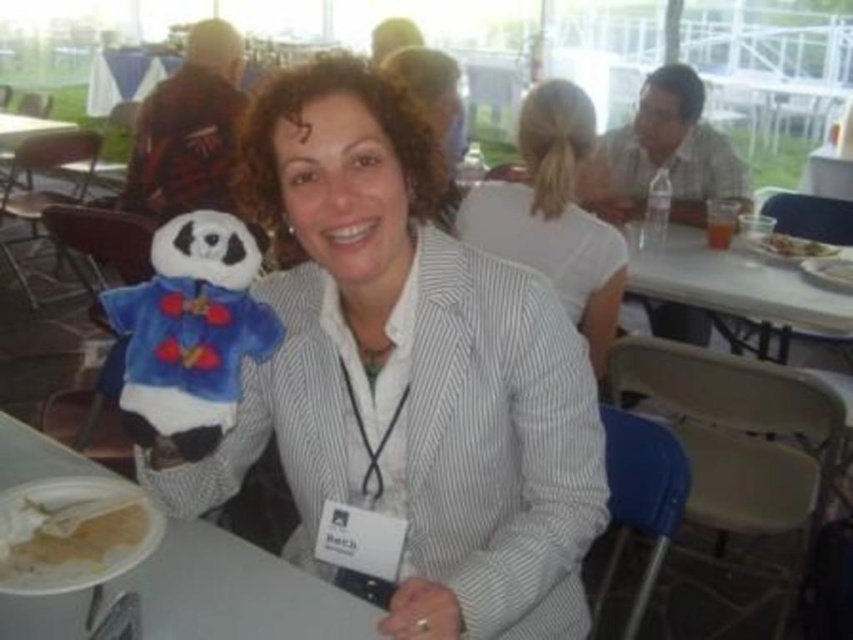
Question: Can you confirm if white plastic plate at lower left is positioned to the right of white matte shirt at upper center?

Choices:
 (A) no
 (B) yes

Answer: (A)

Question: Does white matte shirt at upper center appear on the right side of smooth plastic fork at upper right?

Choices:
 (A) yes
 (B) no

Answer: (B)

Question: Is white matte shirt at upper center below white plastic table at upper right?

Choices:
 (A) no
 (B) yes

Answer: (A)

Question: Which point is farther from the camera taking this photo?

Choices:
 (A) (32, 586)
 (B) (784, 241)

Answer: (B)

Question: Which point appears farthest from the camera in this image?

Choices:
 (A) (538, 604)
 (B) (164, 369)
 (C) (761, 241)

Answer: (C)

Question: Estimate the real-world distances between objects in this image. Which object is farther from the smooth plastic fork at upper right?

Choices:
 (A) white paper plate at lower left
 (B) white matte shirt at upper center
 (C) velvet plush panda at left

Answer: (A)